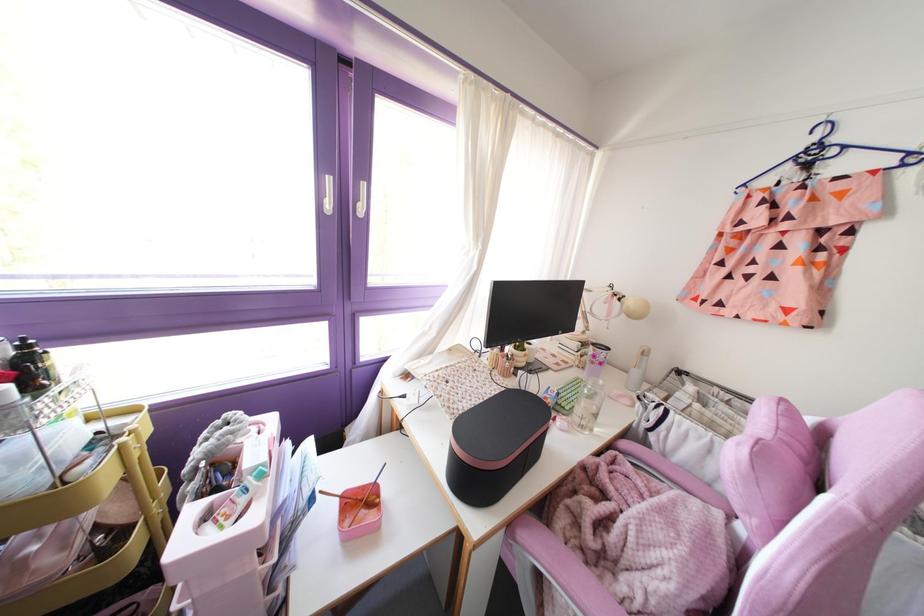
Find the location of a particular element. Image resolution: width=924 pixels, height=616 pixels. black and pink box is located at coordinates (494, 446).